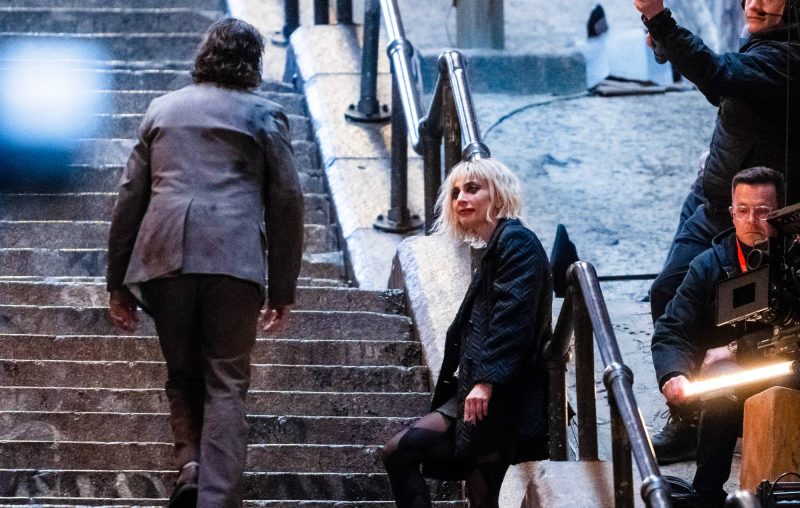
Identify the location of stairs. (53, 239).